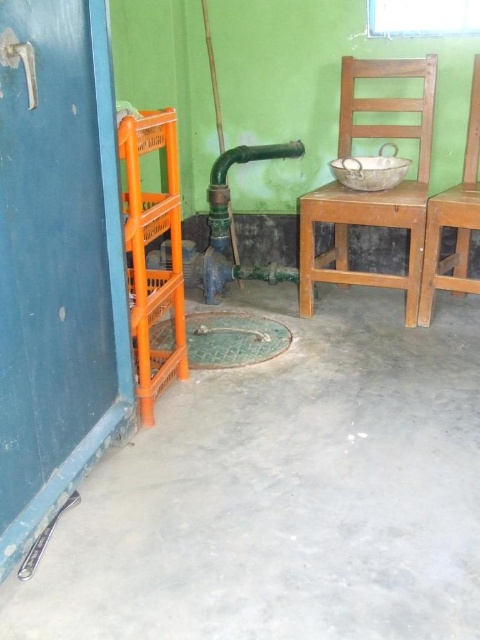
You are standing in the room depicted in the image. You need to place a new wooden chair exactly where the point marked at coordinates point (374, 193) is located. Is there currently any object occupying that spot?

The point (374, 193) marks the location of the wooden chair at center, so yes, the wooden chair at center is already occupying that spot.

You are standing in the room and want to touch both points mentioned. Which point should you reach for first, the point at coordinate (416,132) or the point at (467,145)?

You should reach for the point at coordinate (416,132) first because it is closer to you than the point at (467,145).

You are trying to fit a wooden chair at center and a wooden chair at right through a narrow doorway that is 1 meter wide. Based on their widths, which chair can potentially pass through without needing adjustment?

The wooden chair at right can potentially pass through the doorway since it might be narrower than the wooden chair at center, and the doorway is 1 meter wide.